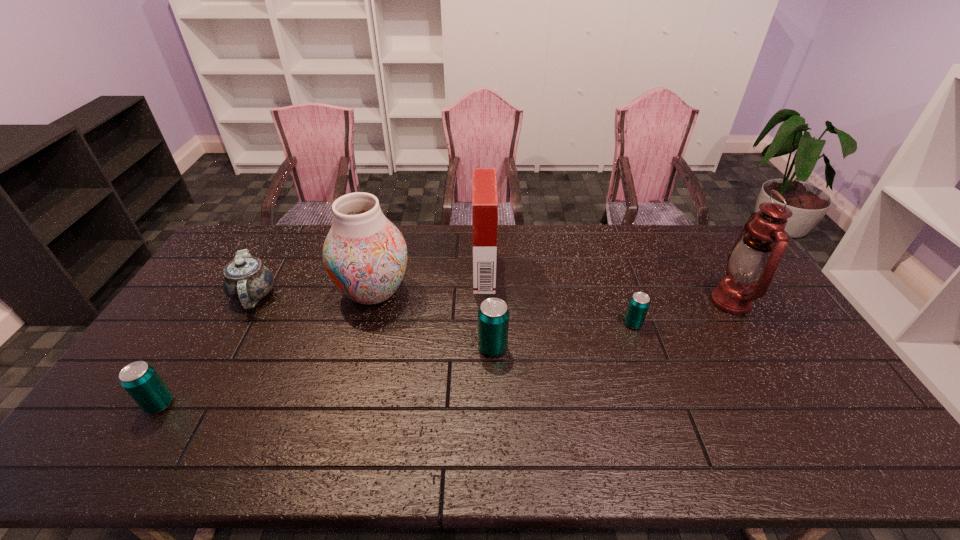
If equal spacing is desired by inserting an extra beer_can among them, please point out a free spot for this new beer_can. Please provide its 2D coordinates. Your answer should be formatted as a tuple, i.e. [(x, y)], where the tuple contains the x and y coordinates of a point satisfying the conditions above.

[(336, 374)]